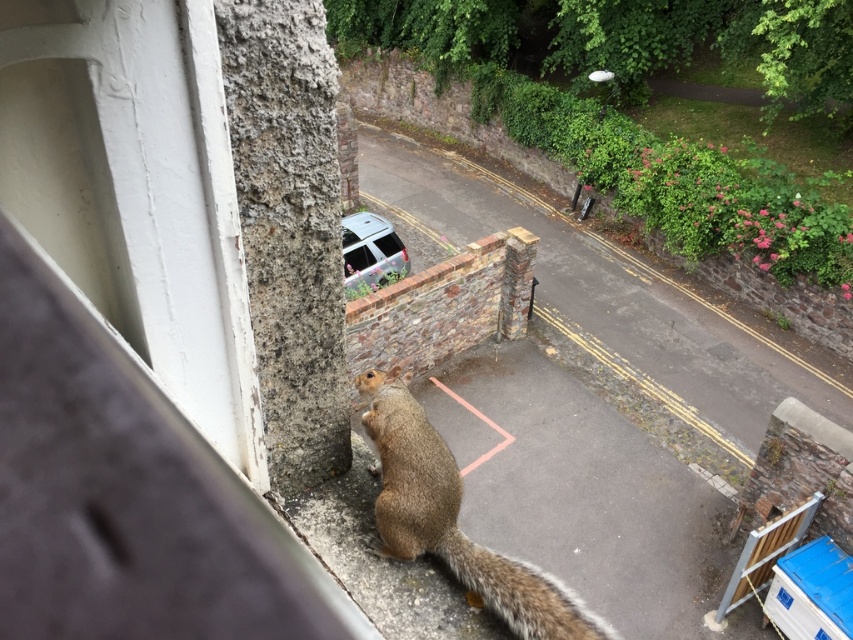
Is brown furry squirrel at lower center positioned at the back of fuzzy brown tail at lower center?

No.

Which is above, brown furry squirrel at lower center or fuzzy brown tail at lower center?

Positioned higher is brown furry squirrel at lower center.

Does point (514, 600) lie in front of point (450, 541)?

Yes, it is.

Where is `brown furry squirrel at lower center`? The height and width of the screenshot is (640, 853). brown furry squirrel at lower center is located at coordinates (453, 518).